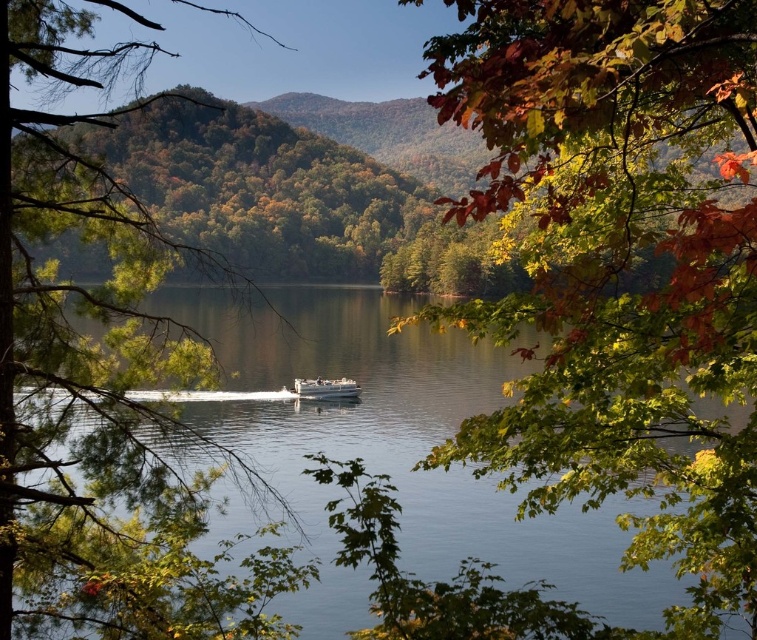
You are standing at the lakeside and notice two elements in the scene. One is autumn leaves at upper right and the other is clear blue water at center. Which of these two elements is positioned to the right side of the other?

The autumn leaves at upper right are positioned to the right of the clear blue water at center.

You are an artist planning to paint this lakeside scene. You want to ensure the autumn leaves at upper right and the green matte tree at center are proportionally accurate. Which object should you paint larger in your artwork?

The autumn leaves at upper right should be painted larger than the green matte tree at center because the description states that the autumn leaves at upper right is bigger than the green matte tree at center.